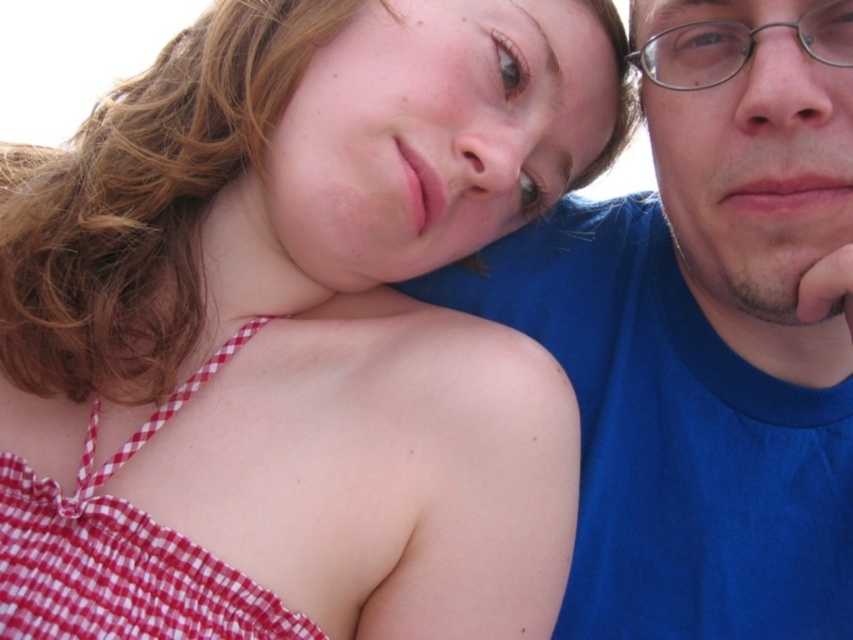
Question: Is blue cotton shirt at upper right in front of metallic silver glasses at upper right?

Choices:
 (A) yes
 (B) no

Answer: (B)

Question: Which object is positioned closest to the blue cotton shirt at upper right?

Choices:
 (A) metallic silver glasses at upper right
 (B) red checkered dress at upper left

Answer: (A)

Question: Which of the following is the closest to the observer?

Choices:
 (A) red checkered dress at upper left
 (B) metallic silver glasses at upper right
 (C) blue cotton shirt at upper right

Answer: (A)

Question: Does red checkered dress at upper left have a lesser width compared to metallic silver glasses at upper right?

Choices:
 (A) yes
 (B) no

Answer: (B)

Question: Is red checkered dress at upper left wider than metallic silver glasses at upper right?

Choices:
 (A) yes
 (B) no

Answer: (A)

Question: Which of the following is the farthest from the observer?

Choices:
 (A) (840, 342)
 (B) (16, 458)

Answer: (A)